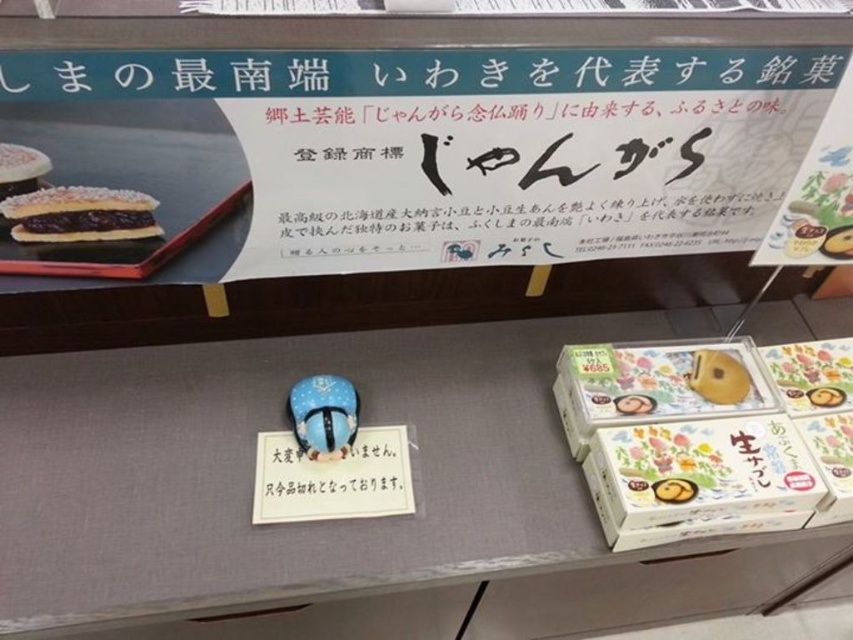
Looking at this image, you are a customer in a Japanese confectionery shop. You want to place a new box of sweets between the matte white box at center and the blue glossy figurine at center. The new box is 10 inches wide. Can it fit in the space between them?

The distance between the matte white box at center and the blue glossy figurine at center is 17.64 inches. Since the new box is 10 inches wide, there is enough space to place it between them as 17.64 inches is greater than 10 inches.